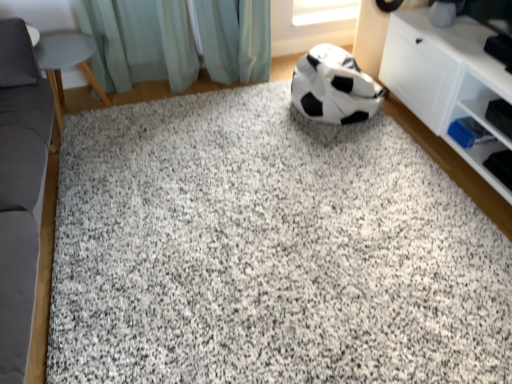
Question: Can you confirm if granite at center is positioned to the left of light teal fabric at upper center?

Choices:
 (A) yes
 (B) no

Answer: (B)

Question: Is granite at center not near light teal fabric at upper center?

Choices:
 (A) yes
 (B) no

Answer: (A)

Question: From the image's perspective, is granite at center below light teal fabric at upper center?

Choices:
 (A) yes
 (B) no

Answer: (A)

Question: Is granite at center located outside light teal fabric at upper center?

Choices:
 (A) yes
 (B) no

Answer: (A)

Question: Is granite at center thinner than light teal fabric at upper center?

Choices:
 (A) no
 (B) yes

Answer: (A)

Question: Does granite at center have a lesser height compared to light teal fabric at upper center?

Choices:
 (A) yes
 (B) no

Answer: (A)

Question: Is black/white matte football at center completely or partially outside of white matte cabinet at right?

Choices:
 (A) no
 (B) yes

Answer: (B)

Question: Is black/white matte football at center shorter than white matte cabinet at right?

Choices:
 (A) yes
 (B) no

Answer: (A)

Question: Is black/white matte football at center smaller than white matte cabinet at right?

Choices:
 (A) no
 (B) yes

Answer: (B)

Question: Is black/white matte football at center in front of white matte cabinet at right?

Choices:
 (A) yes
 (B) no

Answer: (B)

Question: From the image's perspective, would you say black/white matte football at center is shown under white matte cabinet at right?

Choices:
 (A) yes
 (B) no

Answer: (B)

Question: Is black/white matte football at center oriented towards white matte cabinet at right?

Choices:
 (A) yes
 (B) no

Answer: (B)

Question: From a real-world perspective, does matte gray stool at left, marked as the second furniture in a front-to-back arrangement, stand above granite at center?

Choices:
 (A) yes
 (B) no

Answer: (A)